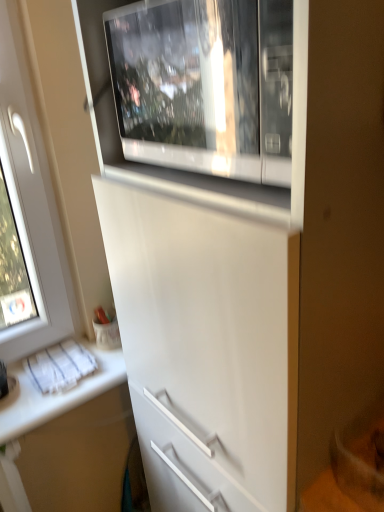
You are a GUI agent. You are given a task and a screenshot of the screen. Output one action in this format:
    pyautogui.click(x=<x>, y=<y>)
    Task: Click on the free space above white glossy countertop at lower left (from a real-world perspective)
    
    Given the screenshot: What is the action you would take?
    pyautogui.click(x=61, y=382)